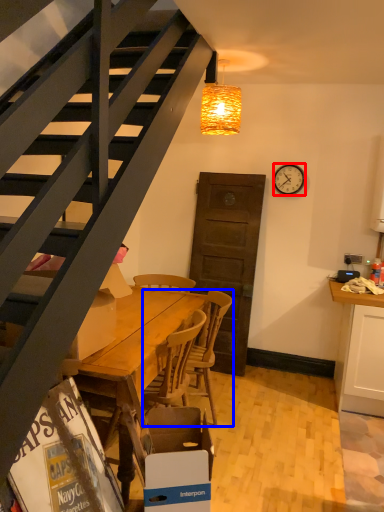
Question: Which of the following is the closest to the observer, clock (highlighted by a red box) or chair (highlighted by a blue box)?

Choices:
 (A) clock
 (B) chair

Answer: (B)